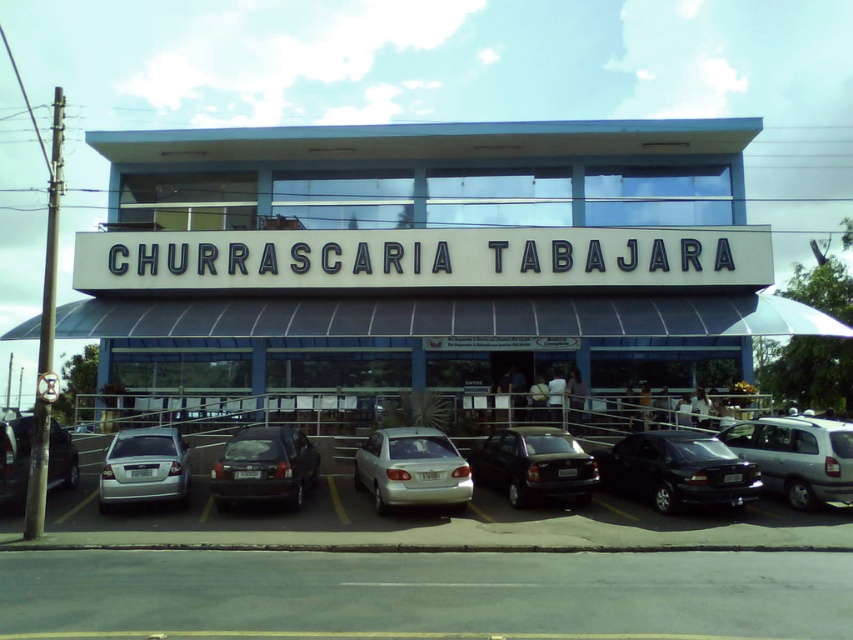
Question: Which object appears farthest from the camera in this image?

Choices:
 (A) dark gray metallic sedan at center
 (B) blue glass building at center
 (C) silver metallic sedan at center

Answer: (B)

Question: Can you confirm if blue glass building at center is positioned below dark gray metallic sedan at center?

Choices:
 (A) no
 (B) yes

Answer: (A)

Question: Among these points, which one is nearest to the camera?

Choices:
 (A) (329, 481)
 (B) (618, 490)
 (C) (4, 458)
 (D) (245, 476)

Answer: (C)

Question: Considering the real-world distances, which object is closest to the dark gray metallic sedan at center?

Choices:
 (A) blue glass building at center
 (B) silver metallic van at center
 (C) silver metallic sedan at center
 (D) silver metallic sedan at left

Answer: (C)

Question: Where is dark gray metallic sedan at center located in relation to satin black hatchback at center in the image?

Choices:
 (A) above
 (B) below

Answer: (A)

Question: Can you confirm if silver metallic cars at lower center is positioned to the left of silver metallic sedan at left?

Choices:
 (A) yes
 (B) no

Answer: (B)